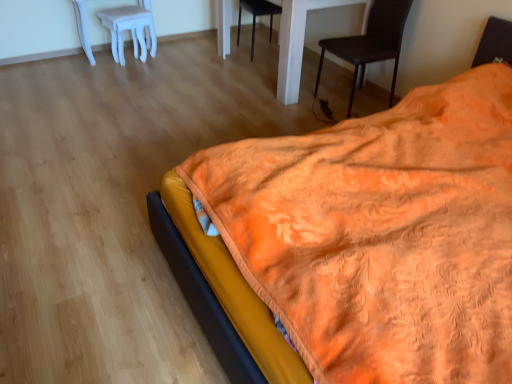
Find the location of a particular element. This screenshot has width=512, height=384. vacant space that is in between white glossy table at center and black leather chair at upper right, which appears as the first chair when viewed from the front is located at coordinates (312, 109).